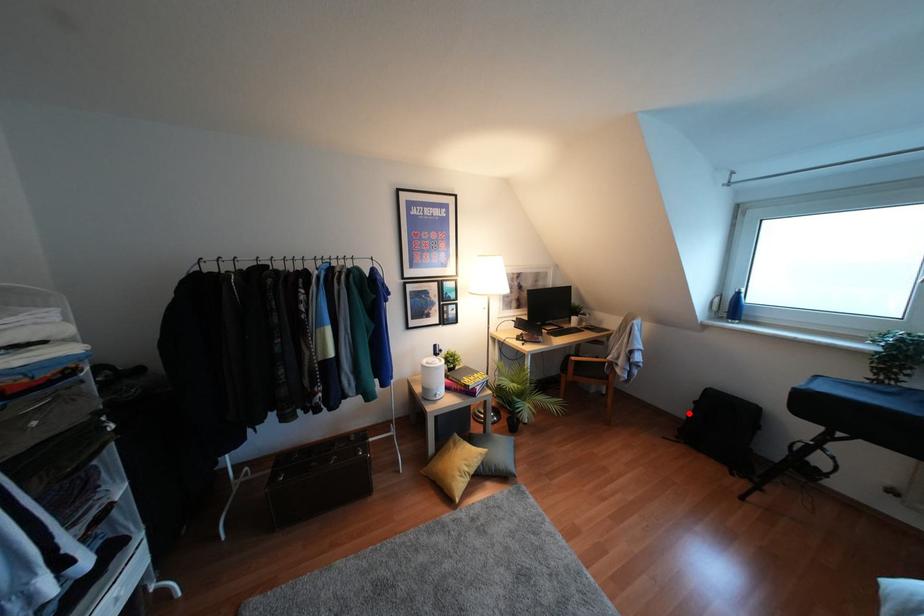
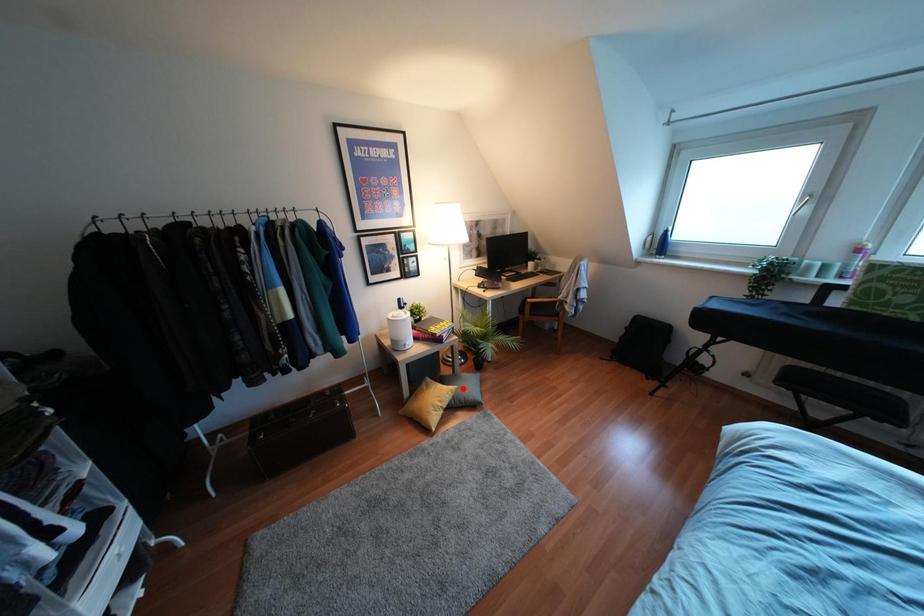
I am providing you with two images of the same scene from different viewpoints. A red point is marked on the first image and another point is marked on the second image. Are the points marked in image1 and image2 representing the same 3D position?

No